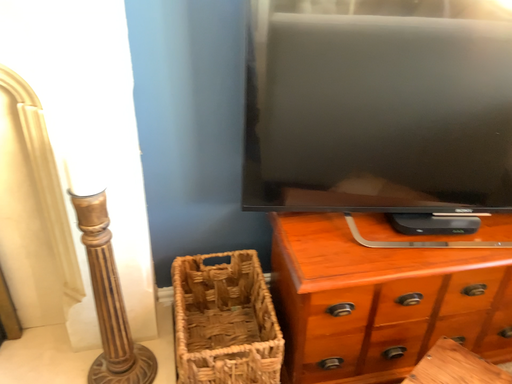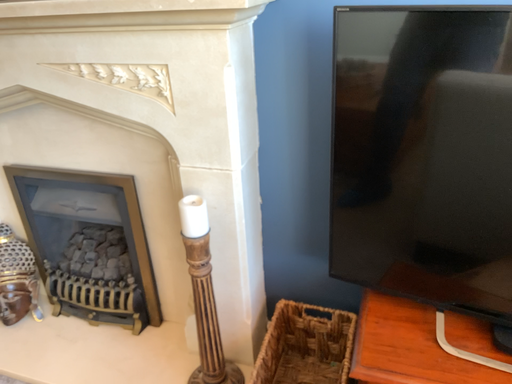
Question: How did the camera likely rotate when shooting the video?

Choices:
 (A) rotated left
 (B) rotated right

Answer: (A)